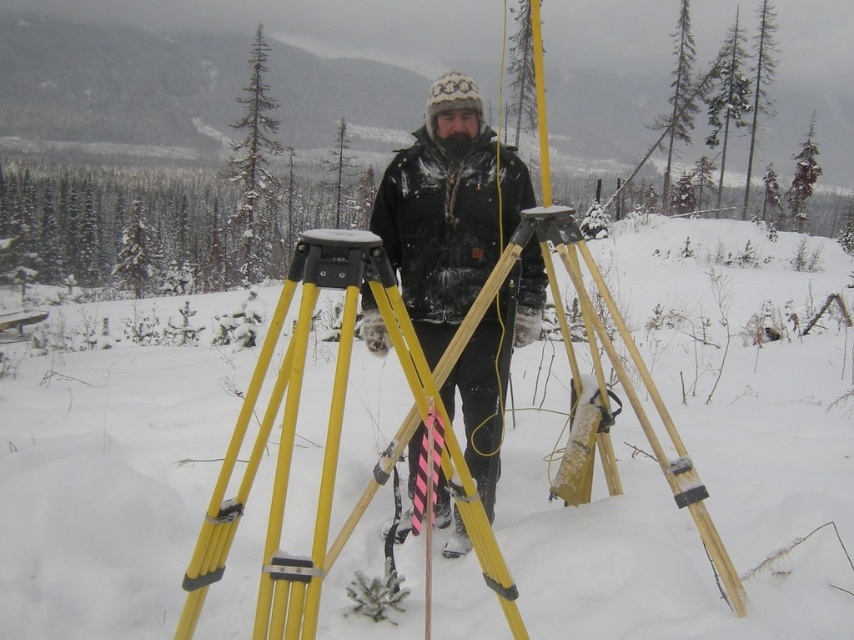
Is black matte jacket at center in front of yellow plastic tripod at center?

No, black matte jacket at center is behind yellow plastic tripod at center.

At what (x,y) coordinates should I click in order to perform the action: click on black matte jacket at center. Please return your answer as a coordinate pair (x, y). This screenshot has width=854, height=640. Looking at the image, I should click on (448, 211).

Does white matte snow at center appear over black matte jacket at center?

Incorrect, white matte snow at center is not positioned above black matte jacket at center.

Is white matte snow at center below black matte jacket at center?

Correct, white matte snow at center is located below black matte jacket at center.

Who is more distant from viewer, (x=33, y=500) or (x=366, y=289)?

Positioned behind is point (x=366, y=289).

Locate an element on the screen. The height and width of the screenshot is (640, 854). white matte snow at center is located at coordinates (107, 484).

Between white matte snow at center and yellow plastic tripod at center, which one is positioned higher?

white matte snow at center is higher up.

Between white matte snow at center and yellow plastic tripod at center, which one appears on the right side from the viewer's perspective?

white matte snow at center is more to the right.

Between point (721, 490) and point (276, 572), which one is positioned in front?

Point (276, 572) is more forward.

Where is `white matte snow at center`? The image size is (854, 640). white matte snow at center is located at coordinates (107, 484).